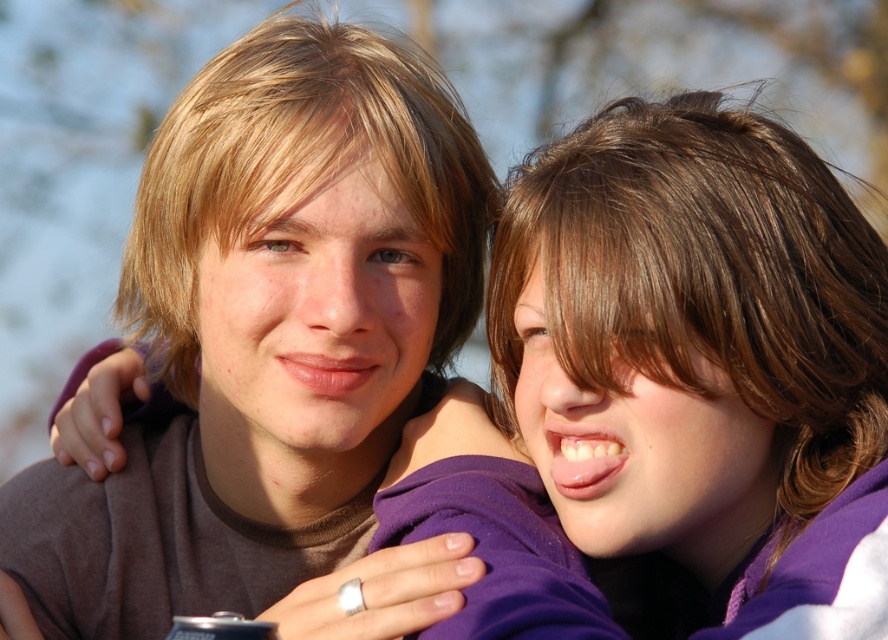
Question: Can you confirm if matte brown hair at center is thinner than purple fabric at upper right?

Choices:
 (A) yes
 (B) no

Answer: (B)

Question: Among these points, which one is farthest from the camera?

Choices:
 (A) (403, 189)
 (B) (649, 134)

Answer: (A)

Question: Does matte brown hair at center have a greater width compared to purple fabric at upper right?

Choices:
 (A) no
 (B) yes

Answer: (B)

Question: Which point appears farthest from the camera in this image?

Choices:
 (A) (884, 490)
 (B) (125, 282)

Answer: (B)

Question: Can you confirm if matte brown hair at center is wider than purple fabric at upper right?

Choices:
 (A) no
 (B) yes

Answer: (B)